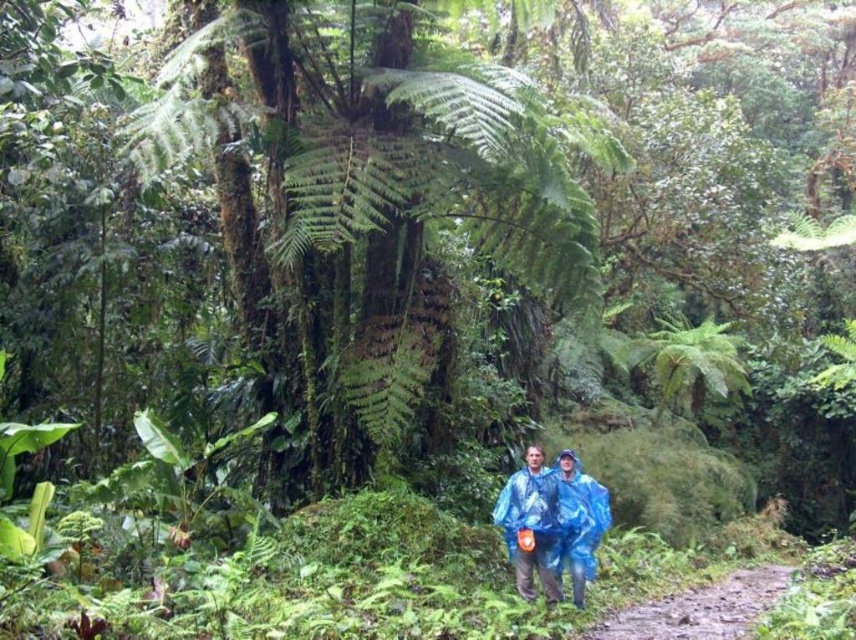
You are navigating a dense tropical forest and need to locate the blue waterproof poncho at center. Based on the coordinates provided, can you determine its position relative to the center of the image?

The blue waterproof poncho at center is located at coordinates point (551, 522), which means it is positioned slightly to the right and above the center of the image.

You are a hiker trying to navigate through the tropical forest. You see the blue waterproof poncho at center and the dirt path at lower center. Which object is higher up in the scene?

The blue waterproof poncho at center is taller than the dirt path at lower center, so the blue waterproof poncho at center is higher up in the scene.

You are hiking in a tropical forest and see the blue waterproof poncho at center and the dirt path at lower center. Which object is positioned to the left of the other?

The blue waterproof poncho at center is to the left of dirt path at lower center.